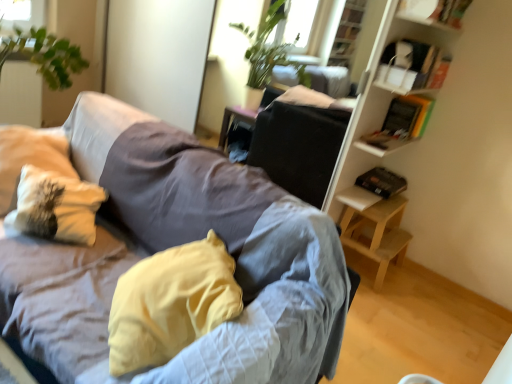
Question: Is white textured pillow at left, which is the 1th pillow in left-to-right order, positioned far away from white cardboard box at upper right, which is counted as the second shelf, starting from the top?

Choices:
 (A) yes
 (B) no

Answer: (A)

Question: Is white textured pillow at left, marked as the second pillow in a right-to-left arrangement, looking in the opposite direction of white cardboard box at upper right, acting as the first shelf starting from the bottom?

Choices:
 (A) no
 (B) yes

Answer: (A)

Question: From the image's perspective, is white textured pillow at left, marked as the second pillow in a right-to-left arrangement, above white cardboard box at upper right, acting as the first shelf starting from the bottom?

Choices:
 (A) yes
 (B) no

Answer: (B)

Question: Is white textured pillow at left, which is the 1th pillow in left-to-right order, bigger than white cardboard box at upper right, which is counted as the second shelf, starting from the top?

Choices:
 (A) yes
 (B) no

Answer: (A)

Question: From the image's perspective, is white textured pillow at left, marked as the second pillow in a right-to-left arrangement, below white cardboard box at upper right, acting as the first shelf starting from the bottom?

Choices:
 (A) no
 (B) yes

Answer: (B)

Question: In terms of width, does yellow fabric pillow at center, the 2th pillow when ordered from left to right, look wider or thinner when compared to light wood table at lower right?

Choices:
 (A) thin
 (B) wide

Answer: (B)

Question: From the image's perspective, relative to light wood table at lower right, is yellow fabric pillow at center, the 2th pillow when ordered from left to right, above or below?

Choices:
 (A) above
 (B) below

Answer: (B)

Question: From their relative heights in the image, would you say yellow fabric pillow at center, the 2th pillow when ordered from left to right, is taller or shorter than light wood table at lower right?

Choices:
 (A) short
 (B) tall

Answer: (B)

Question: Do you think yellow fabric pillow at center, the 2th pillow when ordered from left to right, is within light wood table at lower right, or outside of it?

Choices:
 (A) outside
 (B) inside

Answer: (A)

Question: Would you say yellow fabric pillow at center, which is counted as the first pillow, starting from the right, is to the left or to the right of white textured pillow at left, marked as the second pillow in a right-to-left arrangement, in the picture?

Choices:
 (A) left
 (B) right

Answer: (B)

Question: Considering their positions, is yellow fabric pillow at center, the 2th pillow when ordered from left to right, located in front of or behind white textured pillow at left, which is the 1th pillow in left-to-right order?

Choices:
 (A) front
 (B) behind

Answer: (A)

Question: In terms of size, does yellow fabric pillow at center, the 2th pillow when ordered from left to right, appear bigger or smaller than white textured pillow at left, marked as the second pillow in a right-to-left arrangement?

Choices:
 (A) big
 (B) small

Answer: (A)

Question: Is yellow fabric pillow at center, which is counted as the first pillow, starting from the right, spatially inside white textured pillow at left, marked as the second pillow in a right-to-left arrangement, or outside of it?

Choices:
 (A) inside
 (B) outside

Answer: (B)

Question: From the image's perspective, relative to textured gray couch at center, is yellow fabric pillow at center, which is counted as the first pillow, starting from the right, above or below?

Choices:
 (A) above
 (B) below

Answer: (B)

Question: Considering the positions of point (166, 344) and point (260, 380), is point (166, 344) closer or farther from the camera than point (260, 380)?

Choices:
 (A) farther
 (B) closer

Answer: (A)